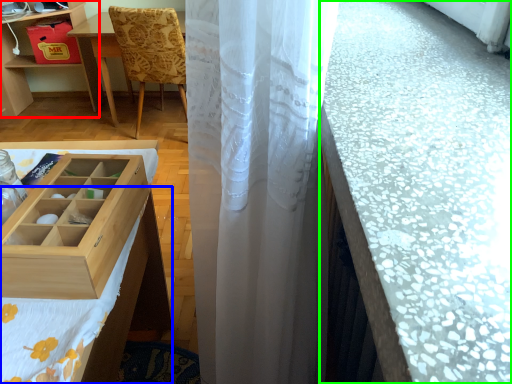
Question: Which object is the farthest from table (highlighted by a red box)? Choose among these: tablecloth (highlighted by a blue box) or counter top (highlighted by a green box).

Choices:
 (A) tablecloth
 (B) counter top

Answer: (B)